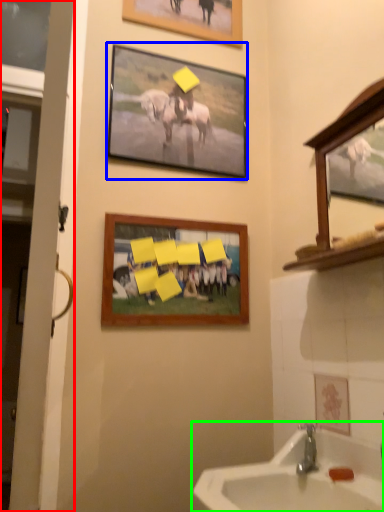
Question: Based on their relative distances, which object is farther from door (highlighted by a red box)? Choose from picture frame (highlighted by a blue box) and sink (highlighted by a green box).

Choices:
 (A) picture frame
 (B) sink

Answer: (A)